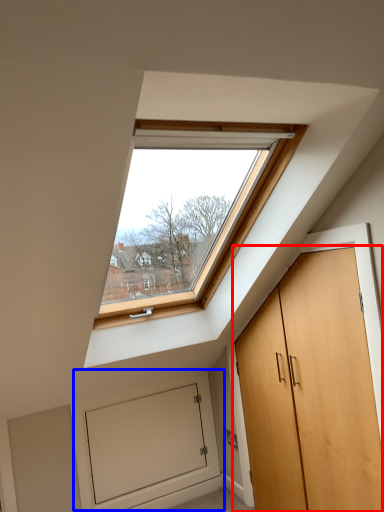
Question: Which point is further to the camera, door (highlighted by a red box) or garage door (highlighted by a blue box)?

Choices:
 (A) door
 (B) garage door

Answer: (B)